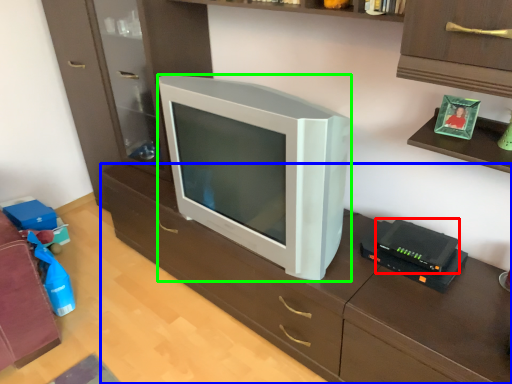
Question: Which object is the farthest from gadget (highlighted by a red box)? Choose among these: computer desk (highlighted by a blue box) or television (highlighted by a green box).

Choices:
 (A) computer desk
 (B) television

Answer: (B)